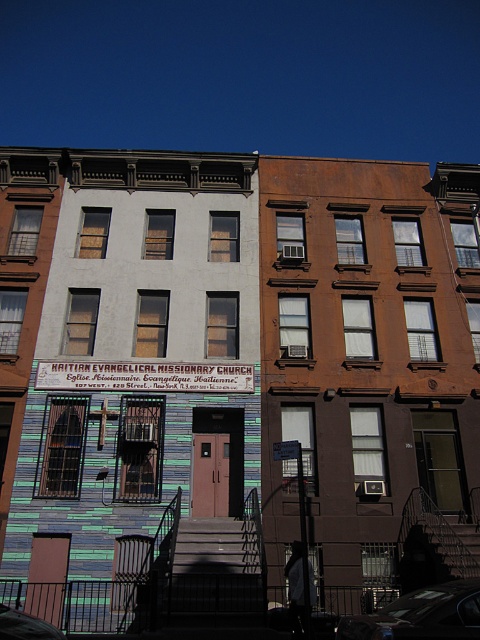
Between metallic silver sign at center and metallic car at lower right, which one is positioned higher?

metallic silver sign at center is above.

Based on the photo, does metallic silver sign at center have a greater height compared to metallic car at lower right?

Incorrect, metallic silver sign at center's height is not larger of metallic car at lower right's.

This screenshot has width=480, height=640. Describe the element at coordinates (144, 376) in the screenshot. I see `metallic silver sign at center` at that location.

In order to click on metallic silver sign at center in this screenshot , I will do `click(144, 376)`.